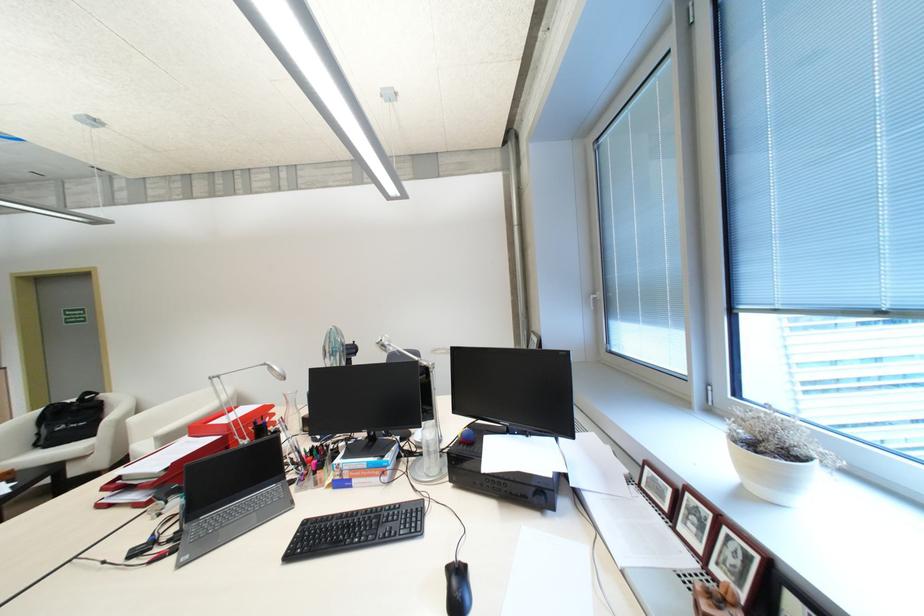
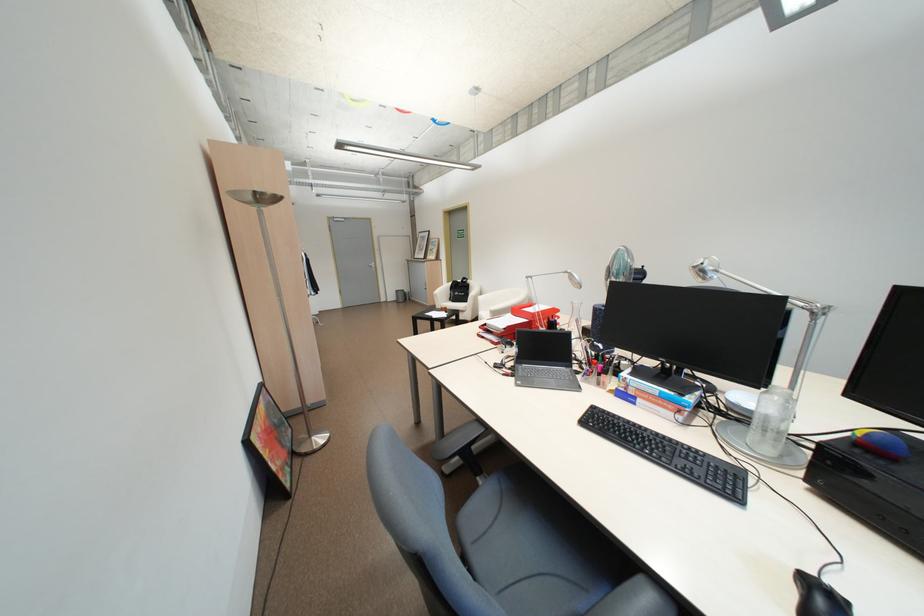
First-person continuous shooting, in which direction is the camera rotating?

The camera's rotation is toward left-down.